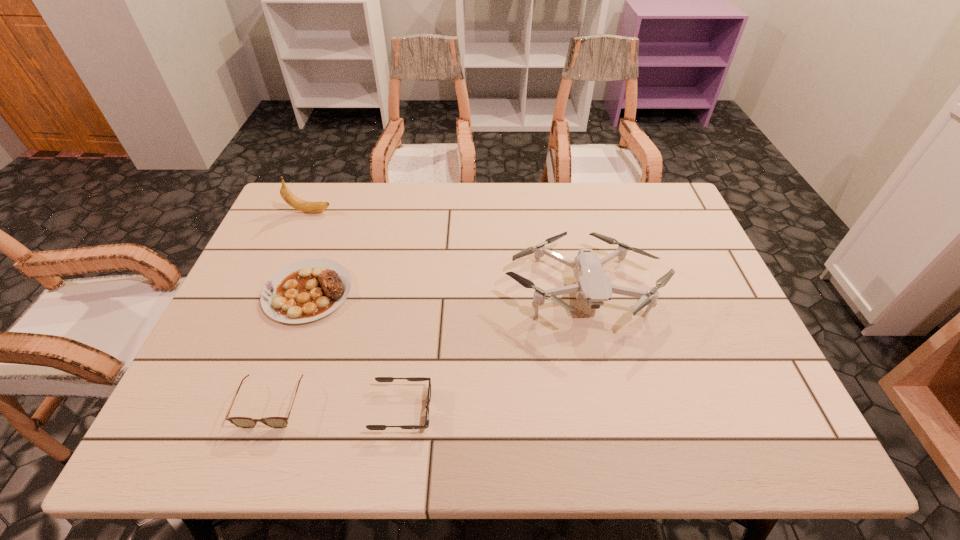
The image size is (960, 540). Find the location of `the farthest object`. the farthest object is located at coordinates (306, 206).

At what (x,y) coordinates should I click in order to perform the action: click on banana. Please return your answer as a coordinate pair (x, y). Image resolution: width=960 pixels, height=540 pixels. Looking at the image, I should click on (306, 206).

Identify the location of drone. (593, 285).

This screenshot has height=540, width=960. What are the coordinates of `the rightmost object` in the screenshot? It's located at (593, 285).

This screenshot has width=960, height=540. What are the coordinates of `steak` in the screenshot? It's located at (307, 290).

You are a GUI agent. You are given a task and a screenshot of the screen. Output one action in this format:
    pyautogui.click(x=<x>, y=<y>)
    Task: Click on the spectacles
    The width and height of the screenshot is (960, 540).
    Given the screenshot: What is the action you would take?
    pyautogui.click(x=243, y=422)

In order to click on the second object from right to left in this screenshot , I will do `click(379, 379)`.

Identify the location of the shortest object. (379, 379).

Locate an element on the screen. Image resolution: width=960 pixels, height=540 pixels. vacant area located 0.150m at the start of the peel on the farthest object is located at coordinates (379, 212).

The image size is (960, 540). Find the location of `vacant region located 0.210m with a camera at the front of the second tallest object`. vacant region located 0.210m with a camera at the front of the second tallest object is located at coordinates (612, 422).